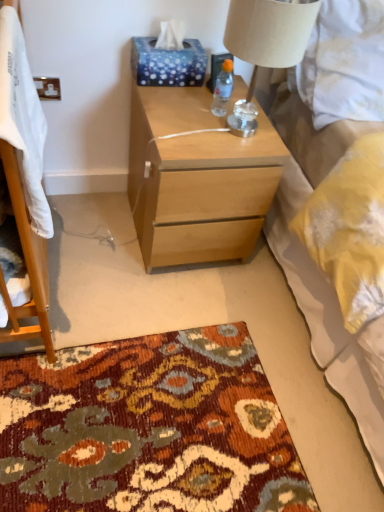
Find the location of a particular element. This screenshot has height=512, width=384. vacant area that lies in front of light wood/finish nightstand at center is located at coordinates (160, 305).